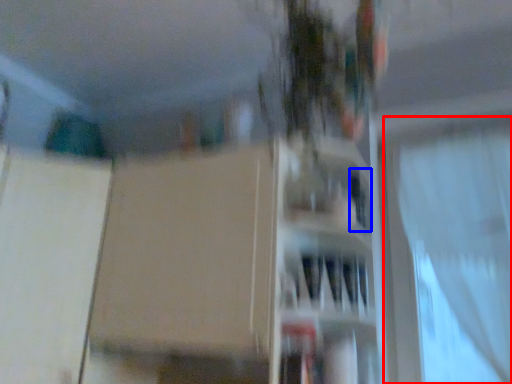
Question: Among these objects, which one is nearest to the camera, curtain (highlighted by a red box) or window (highlighted by a blue box)?

Choices:
 (A) curtain
 (B) window

Answer: (A)